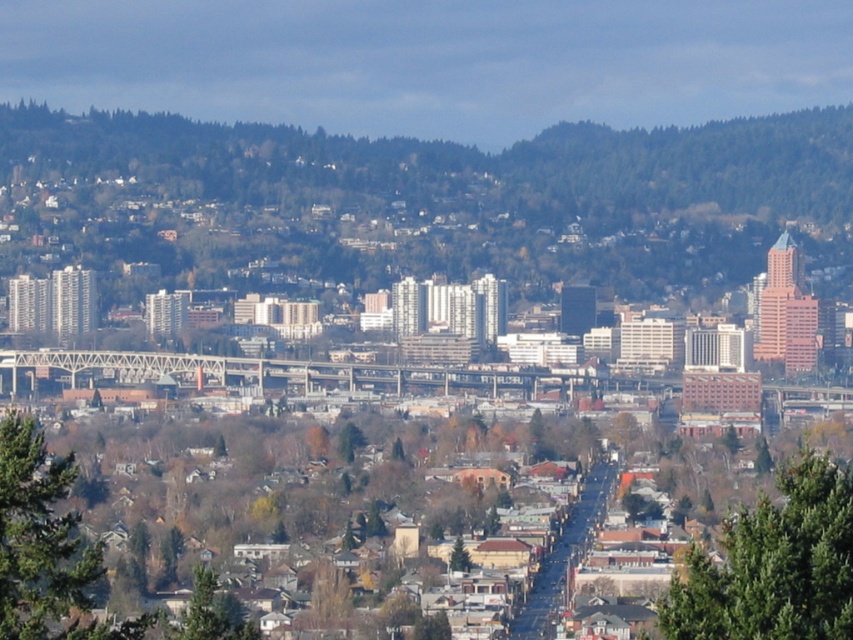
Is point (669, 253) positioned behind point (828, 577)?

No, it is not.

Does green forested mountain at center have a lesser height compared to green textured tree at lower right?

No, green forested mountain at center is not shorter than green textured tree at lower right.

Describe the element at coordinates (422, 204) in the screenshot. Image resolution: width=853 pixels, height=640 pixels. I see `green forested mountain at center` at that location.

In order to click on green forested mountain at center in this screenshot , I will do pyautogui.click(x=422, y=204).

Who is positioned more to the right, green leafy tree at lower left or green leafy tree at center?

Positioned to the right is green leafy tree at center.

Which is more to the left, green leafy tree at lower left or green leafy tree at center?

green leafy tree at lower left is more to the left.

Does point (62, 465) come behind point (456, 540)?

Yes, point (62, 465) is farther from viewer.

Where is `green leafy tree at lower left`? green leafy tree at lower left is located at coordinates (45, 547).

From the picture: Is green textured tree at lower right closer to camera compared to green leafy tree at center?

No.

What do you see at coordinates (775, 564) in the screenshot?
I see `green textured tree at lower right` at bounding box center [775, 564].

The image size is (853, 640). Identify the location of green textured tree at lower right. (775, 564).

This screenshot has height=640, width=853. In order to click on green textured tree at lower right in this screenshot , I will do `click(775, 564)`.